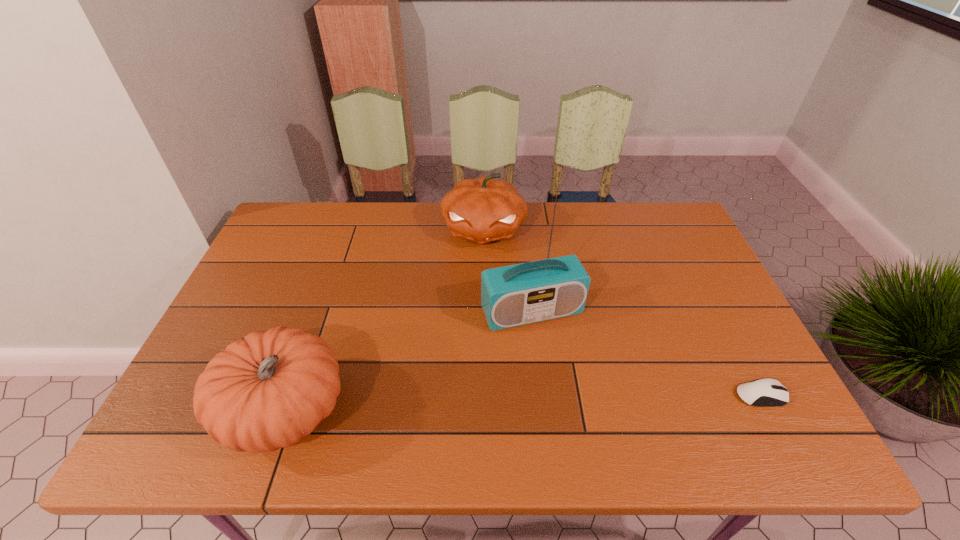
At what (x,y) coordinates should I click in order to perform the action: click on vacant point located on the front face of the right pumpkin. Please return your answer as a coordinate pair (x, y). Looking at the image, I should click on (473, 318).

I want to click on free space located on the front face of the right pumpkin, so click(x=474, y=310).

The width and height of the screenshot is (960, 540). Identify the location of free point located on the front face of the right pumpkin. (473, 318).

I want to click on free space located on the front panel of the radio receiver, so click(571, 385).

Where is `vacant point located on the front panel of the radio receiver`? The image size is (960, 540). vacant point located on the front panel of the radio receiver is located at coordinates (557, 354).

This screenshot has height=540, width=960. In order to click on free spot located on the front panel of the radio receiver in this screenshot , I will do `click(557, 354)`.

Identify the location of object present at the far edge. The width and height of the screenshot is (960, 540). [x=484, y=209].

Identify the location of pumpkin that is positioned at the near edge. (269, 389).

The width and height of the screenshot is (960, 540). I want to click on mouse present at the near edge, so click(767, 392).

You are a GUI agent. You are given a task and a screenshot of the screen. Output one action in this format:
    pyautogui.click(x=<x>, y=<y>)
    Task: Click on the object at the left edge
    The width and height of the screenshot is (960, 540).
    Given the screenshot: What is the action you would take?
    pyautogui.click(x=269, y=389)